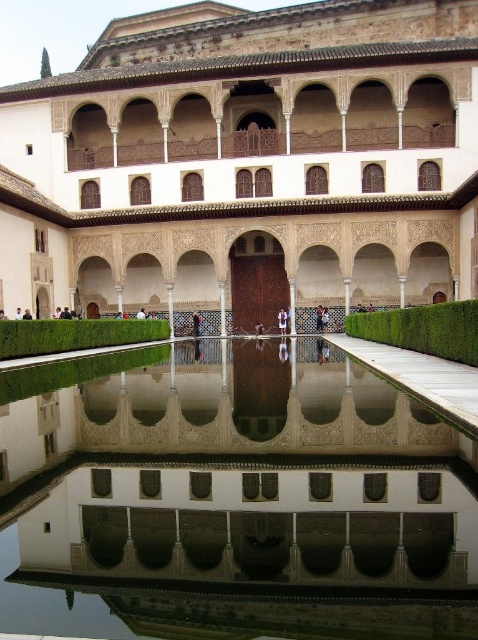
You are an architect visiting the courtyard and need to place a new decorative item. The brown leather jacket at center is currently placed where the white marble pillar at center is located. Would the pillar fit in the jacket? Explain why.

The white marble pillar at center is bigger than the brown leather jacket at center, so the pillar cannot fit inside the jacket because it is larger in size.